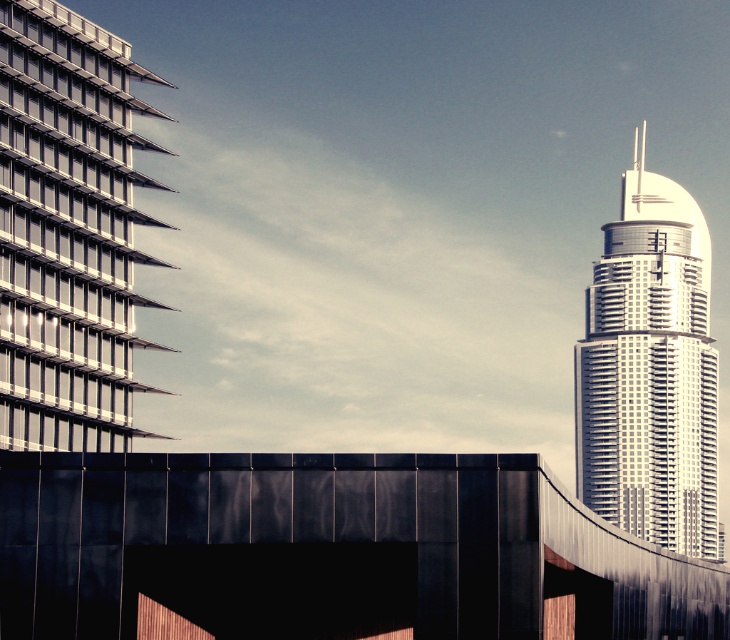
Describe the element at coordinates (69, 230) in the screenshot. Image resolution: width=730 pixels, height=640 pixels. I see `metallic glass skyscraper at left` at that location.

Does point (82, 102) come in front of point (614, 493)?

That is True.

Which is behind, point (119, 147) or point (699, 497)?

Point (699, 497)

Image resolution: width=730 pixels, height=640 pixels. I want to click on metallic glass skyscraper at left, so click(69, 230).